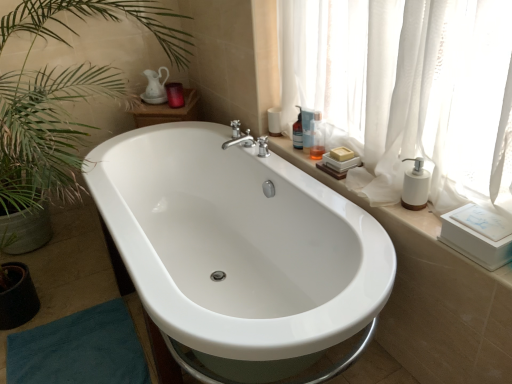
Find the location of a particular element. The image size is (512, 384). teal fabric bath mat at lower left is located at coordinates (79, 350).

You are a GUI agent. You are given a task and a screenshot of the screen. Output one action in this format:
    pyautogui.click(x=<x>, y=<y>)
    Task: Click on the translucent glass bottle at upper right, the 2th toiletry in the left-to-right sequence
    Image resolution: width=512 pixels, height=384 pixels.
    Given the screenshot: What is the action you would take?
    pyautogui.click(x=298, y=132)

Where is `white matte soap dispenser at right`? The height and width of the screenshot is (384, 512). white matte soap dispenser at right is located at coordinates (415, 186).

Could you tell me if matte purple candle at upper center, the 4th toiletry viewed from the right, is facing teal fabric bath mat at lower left?

No, matte purple candle at upper center, the 4th toiletry viewed from the right, is not aimed at teal fabric bath mat at lower left.

You are a GUI agent. You are given a task and a screenshot of the screen. Output one action in this format:
    pyautogui.click(x=<x>, y=<y>)
    Task: Click on the toiletry that is the 4th object located behind the teal fabric bath mat at lower left
    Image resolution: width=512 pixels, height=384 pixels.
    Given the screenshot: What is the action you would take?
    pyautogui.click(x=175, y=95)

Does point (165, 85) come behind point (129, 362)?

Yes, it is.

Looking at this image, does matte purple candle at upper center, the 1th toiletry from the left, touch teal fabric bath mat at lower left?

They are not placed beside each other.

Does matte purple candle at upper center, the 4th toiletry in the front-to-back sequence, have a greater height compared to translucent plastic bottle at upper right, positioned as the second toiletry in right-to-left order?

No, matte purple candle at upper center, the 4th toiletry in the front-to-back sequence, is not taller than translucent plastic bottle at upper right, positioned as the second toiletry in right-to-left order.

From a real-world perspective, is matte purple candle at upper center, the first toiletry from the back, positioned over translucent plastic bottle at upper right, the 2th toiletry when ordered from front to back, based on gravity?

No, from a real-world perspective, matte purple candle at upper center, the first toiletry from the back, is not over translucent plastic bottle at upper right, the 2th toiletry when ordered from front to back

How many degrees apart are the facing directions of matte purple candle at upper center, the 1th toiletry from the left, and translucent plastic bottle at upper right, acting as the third toiletry starting from the left?

48.9 degrees separate the facing orientations of matte purple candle at upper center, the 1th toiletry from the left, and translucent plastic bottle at upper right, acting as the third toiletry starting from the left.

From the image's perspective, is matte purple candle at upper center, the 1th toiletry from the left, above or below translucent plastic bottle at upper right, positioned as the second toiletry in right-to-left order?

Clearly, from the image's perspective, matte purple candle at upper center, the 1th toiletry from the left, is above translucent plastic bottle at upper right, positioned as the second toiletry in right-to-left order.

Is translucent plastic bottle at upper right, the third toiletry from the back, thinner than white glossy bathtub at center?

Yes, translucent plastic bottle at upper right, the third toiletry from the back, is thinner than white glossy bathtub at center.

How different are the orientations of translucent plastic bottle at upper right, the 2th toiletry when ordered from front to back, and white glossy bathtub at center in degrees?

The angle between the facing direction of translucent plastic bottle at upper right, the 2th toiletry when ordered from front to back, and the facing direction of white glossy bathtub at center is 9.48 degrees.

Does translucent plastic bottle at upper right, the 2th toiletry when ordered from front to back, have a larger size compared to white glossy bathtub at center?

Incorrect, translucent plastic bottle at upper right, the 2th toiletry when ordered from front to back, is not larger than white glossy bathtub at center.

Which object is further away from the camera, translucent plastic bottle at upper right, the third toiletry from the back, or white glossy bathtub at center?

Positioned behind is translucent plastic bottle at upper right, the third toiletry from the back.

Is translucent glass bottle at upper right, marked as the 3th toiletry in a right-to-left arrangement, beside white ceramic window sill at upper right?

No, translucent glass bottle at upper right, marked as the 3th toiletry in a right-to-left arrangement, is not beside white ceramic window sill at upper right.

Would you say translucent glass bottle at upper right, the 2th toiletry positioned from the back, is inside or outside white ceramic window sill at upper right?

translucent glass bottle at upper right, the 2th toiletry positioned from the back, lies outside white ceramic window sill at upper right.

What's the angular difference between translucent glass bottle at upper right, positioned as the 3th toiletry in front-to-back order, and white ceramic window sill at upper right's facing directions?

1.52 degrees separate the facing orientations of translucent glass bottle at upper right, positioned as the 3th toiletry in front-to-back order, and white ceramic window sill at upper right.

Find the location of a particular element. This screenshot has height=384, width=512. window sill that appears below the translucent glass bottle at upper right, positioned as the 3th toiletry in front-to-back order (from the image's perspective) is located at coordinates (404, 229).

Is point (312, 124) closer or farther from the camera than point (310, 147)?

Clearly, point (312, 124) is closer to the camera than point (310, 147).

Does translucent plastic bottle at upper right, the third toiletry from the back, lie behind translucent plastic bottle at upper right, which is the 4th toiletry in back-to-front order?

Yes, translucent plastic bottle at upper right, the third toiletry from the back, is behind translucent plastic bottle at upper right, which is the 4th toiletry in back-to-front order.

Considering the relative sizes of translucent plastic bottle at upper right, positioned as the second toiletry in right-to-left order, and translucent plastic bottle at upper right, the fourth toiletry viewed from the left, in the image provided, is translucent plastic bottle at upper right, positioned as the second toiletry in right-to-left order, bigger than translucent plastic bottle at upper right, the fourth toiletry viewed from the left,?

No.

Considering the relative positions of translucent plastic bottle at upper right, positioned as the second toiletry in right-to-left order, and translucent plastic bottle at upper right, which appears as the first toiletry when viewed from the front, in the image provided, is translucent plastic bottle at upper right, positioned as the second toiletry in right-to-left order, to the left of translucent plastic bottle at upper right, which appears as the first toiletry when viewed from the front, from the viewer's perspective?

Yes, translucent plastic bottle at upper right, positioned as the second toiletry in right-to-left order, is to the left of translucent plastic bottle at upper right, which appears as the first toiletry when viewed from the front.

How many degrees apart are the facing directions of white sheer curtain at upper right and white matte soap dispenser at right?

1.44 degrees.

Can you confirm if white sheer curtain at upper right is positioned to the right of white matte soap dispenser at right?

Incorrect, white sheer curtain at upper right is not on the right side of white matte soap dispenser at right.

Is white sheer curtain at upper right in front of or behind white matte soap dispenser at right in the image?

Clearly, white sheer curtain at upper right is in front of white matte soap dispenser at right.

From a real-world perspective, between white sheer curtain at upper right and white matte soap dispenser at right, who is vertically lower?

white matte soap dispenser at right, from a real-world perspective.

From the image's perspective, between translucent plastic bottle at upper right, which appears as the first toiletry when viewed from the front, and white glossy bathtub at center, which one is located above?

translucent plastic bottle at upper right, which appears as the first toiletry when viewed from the front, appears higher in the image.

Does translucent plastic bottle at upper right, the first toiletry viewed from the right, contain white glossy bathtub at center?

Definitely not — white glossy bathtub at center is not inside translucent plastic bottle at upper right, the first toiletry viewed from the right.

Considering the sizes of objects translucent plastic bottle at upper right, which is the 4th toiletry in back-to-front order, and white glossy bathtub at center in the image provided, who is bigger, translucent plastic bottle at upper right, which is the 4th toiletry in back-to-front order, or white glossy bathtub at center?

Bigger between the two is white glossy bathtub at center.

Is white glossy bathtub at center at the back of translucent plastic bottle at upper right, the first toiletry viewed from the right?

No.

Where is `bath mat that appears below the matte purple candle at upper center, the first toiletry from the back (from a real-world perspective)`? bath mat that appears below the matte purple candle at upper center, the first toiletry from the back (from a real-world perspective) is located at coordinates (79, 350).

Locate an element on the screen. toiletry that is the 2nd one when counting forward from the matte purple candle at upper center, the 1th toiletry from the left is located at coordinates point(307,128).

Estimate the real-world distances between objects in this image. Which object is further from white sheer curtain at upper right, translucent glass bottle at upper right, positioned as the 3th toiletry in front-to-back order, or translucent plastic bottle at upper right, the 2th toiletry when ordered from front to back?

The object further to white sheer curtain at upper right is translucent glass bottle at upper right, positioned as the 3th toiletry in front-to-back order.

Considering their positions, is white sheer curtain at upper right positioned further to white glossy bathtub at center than teal fabric bath mat at lower left?

Among the two, teal fabric bath mat at lower left is located further to white glossy bathtub at center.

When comparing their distances from translucent plastic bottle at upper right, which is the 4th toiletry in back-to-front order, does white glossy bathtub at center or teal fabric bath mat at lower left seem further?

teal fabric bath mat at lower left.

Looking at this image, based on their spatial positions, is teal fabric bath mat at lower left or white ceramic window sill at upper right closer to translucent glass bottle at upper right, the 2th toiletry in the left-to-right sequence?

white ceramic window sill at upper right is positioned closer to the anchor translucent glass bottle at upper right, the 2th toiletry in the left-to-right sequence.

Which object lies nearer to the anchor point translucent glass bottle at upper right, positioned as the 3th toiletry in front-to-back order, white glossy bathtub at center or white sheer curtain at upper right?

Based on the image, white sheer curtain at upper right appears to be nearer to translucent glass bottle at upper right, positioned as the 3th toiletry in front-to-back order.

Estimate the real-world distances between objects in this image. Which object is further from translucent glass bottle at upper right, positioned as the 3th toiletry in front-to-back order, translucent plastic bottle at upper right, the fourth toiletry viewed from the left, or matte purple candle at upper center, the 4th toiletry in the front-to-back sequence?

Based on the image, matte purple candle at upper center, the 4th toiletry in the front-to-back sequence, appears to be further to translucent glass bottle at upper right, positioned as the 3th toiletry in front-to-back order.

Estimate the real-world distances between objects in this image. Which object is further from white ceramic window sill at upper right, matte purple candle at upper center, the 4th toiletry viewed from the right, or teal fabric bath mat at lower left?

matte purple candle at upper center, the 4th toiletry viewed from the right, is positioned further to the anchor white ceramic window sill at upper right.

Consider the image. Which object lies further to the anchor point translucent plastic bottle at upper right, the first toiletry viewed from the right, white sheer curtain at upper right or white matte soap dispenser at right?

white matte soap dispenser at right is positioned further to the anchor translucent plastic bottle at upper right, the first toiletry viewed from the right.

This screenshot has width=512, height=384. What are the coordinates of `toiletry between white sheer curtain at upper right and translucent plastic bottle at upper right, positioned as the second toiletry in right-to-left order, in the front-back direction` in the screenshot? It's located at (317, 137).

In order to click on soap dispenser between white ceramic window sill at upper right and translucent plastic bottle at upper right, which is the 4th toiletry in back-to-front order, along the z-axis in this screenshot , I will do `click(415, 186)`.

You are a GUI agent. You are given a task and a screenshot of the screen. Output one action in this format:
    pyautogui.click(x=<x>, y=<y>)
    Task: Click on the soap dispenser positioned between white glossy bathtub at center and translucent glass bottle at upper right, marked as the 3th toiletry in a right-to-left arrangement, from near to far
    
    Given the screenshot: What is the action you would take?
    pyautogui.click(x=415, y=186)

Identify the location of window sill positioned between white glossy bathtub at center and matte purple candle at upper center, the 4th toiletry viewed from the right, from near to far. This screenshot has width=512, height=384. (404, 229).